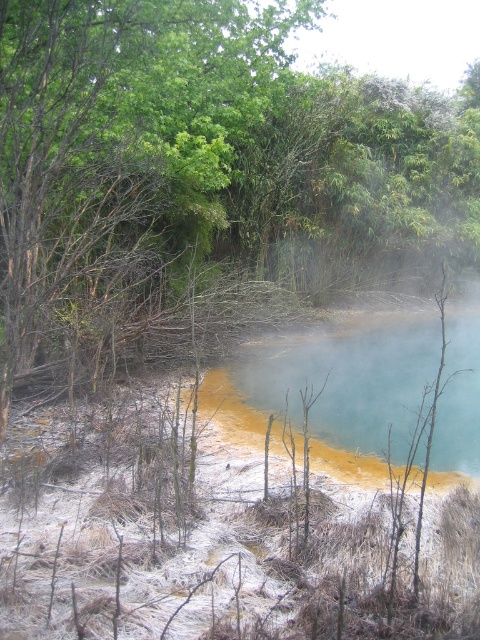
Is green leafy tree at upper center taller than blue-green water at center?

Yes.

Who is more distant from viewer, (457,148) or (252,396)?

Point (457,148)

Who is more forward, (6, 324) or (362, 340)?

Point (6, 324)

Where is `green leafy tree at upper center`? Image resolution: width=480 pixels, height=640 pixels. green leafy tree at upper center is located at coordinates (200, 163).